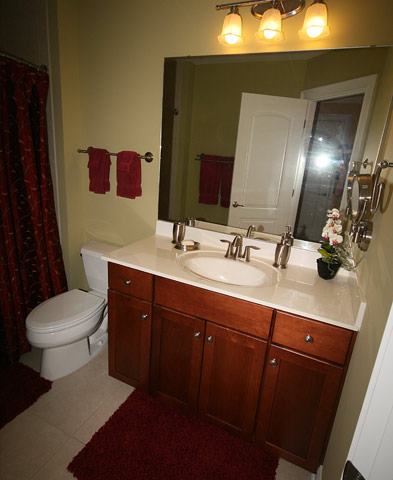
At what (x,y) coordinates should I click in order to perform the action: click on toilet. Please return your answer as a coordinate pair (x, y). Looking at the image, I should click on (61, 313).